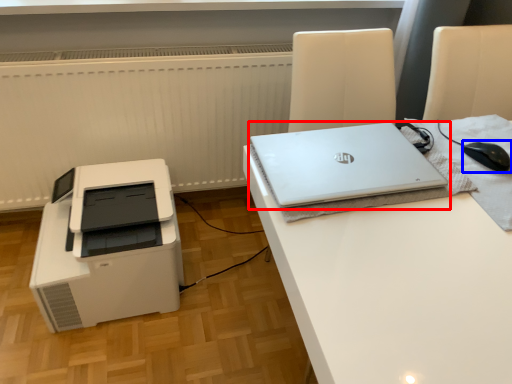
Question: Which object appears closest to the camera in this image, laptop (highlighted by a red box) or mouse (highlighted by a blue box)?

Choices:
 (A) laptop
 (B) mouse

Answer: (A)